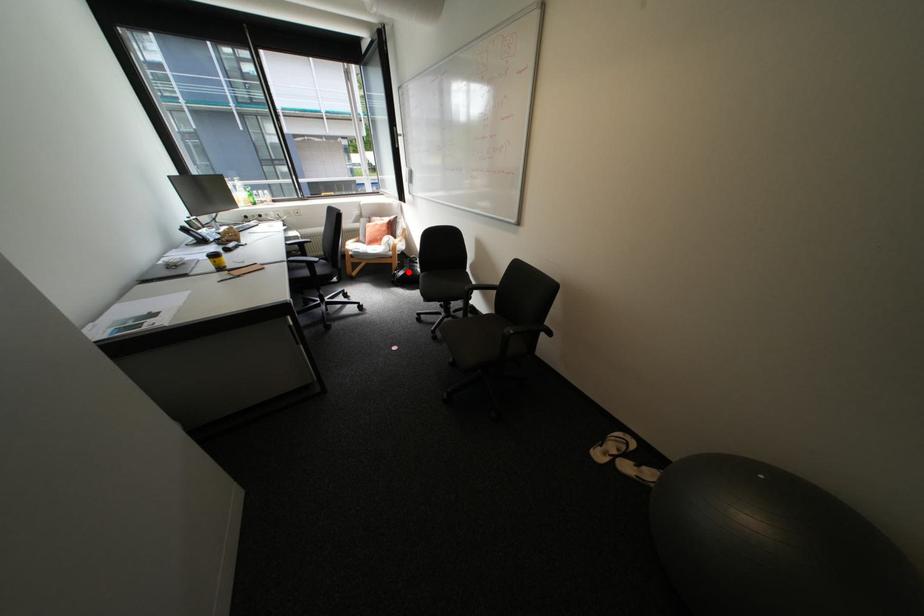
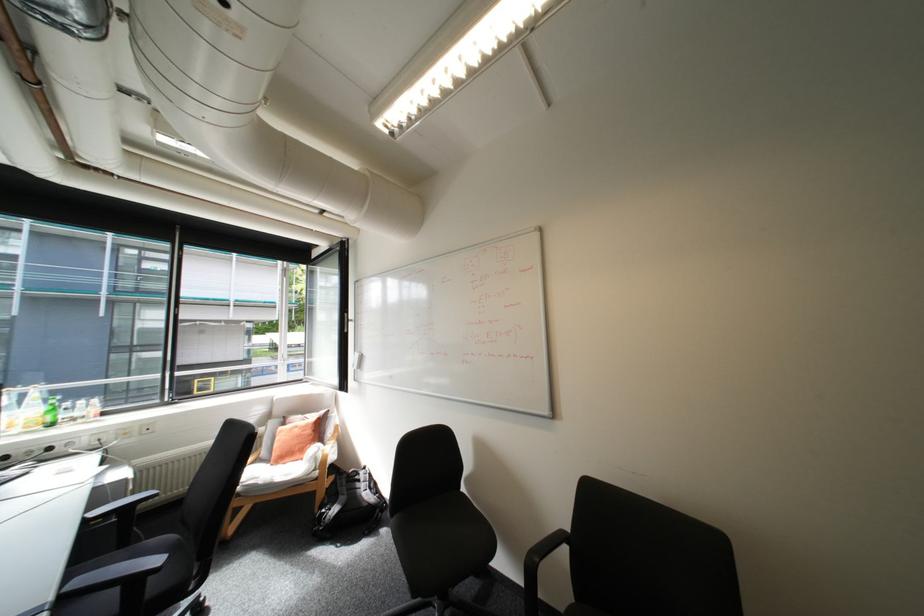
Locate, in the second image, the point that corresponds to the highlighted location in the first image.

(339, 509)